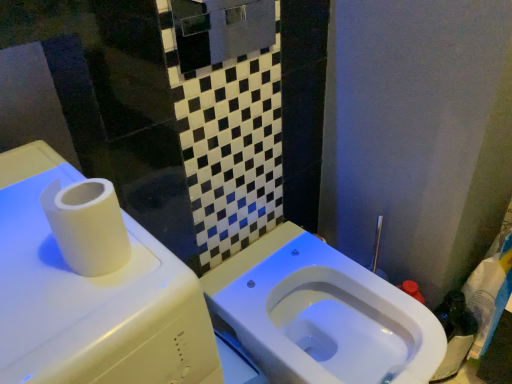
Question: Can you confirm if white matte water tank at upper left is positioned to the left of white glossy toilet at center?

Choices:
 (A) yes
 (B) no

Answer: (A)

Question: Is white matte water tank at upper left oriented away from white glossy toilet at center?

Choices:
 (A) yes
 (B) no

Answer: (B)

Question: From a real-world perspective, is white matte water tank at upper left positioned under white glossy toilet at center based on gravity?

Choices:
 (A) yes
 (B) no

Answer: (B)

Question: From a real-world perspective, is white matte water tank at upper left physically above white glossy toilet at center?

Choices:
 (A) yes
 (B) no

Answer: (A)

Question: Is white matte water tank at upper left completely or partially outside of white glossy toilet at center?

Choices:
 (A) yes
 (B) no

Answer: (A)

Question: Are white matte water tank at upper left and white glossy toilet at center far apart?

Choices:
 (A) no
 (B) yes

Answer: (A)

Question: From the image's perspective, is white glossy toilet at center over white matte water tank at upper left?

Choices:
 (A) yes
 (B) no

Answer: (B)

Question: Is white glossy toilet at center turned away from white matte water tank at upper left?

Choices:
 (A) yes
 (B) no

Answer: (B)

Question: Does white glossy toilet at center come in front of white matte water tank at upper left?

Choices:
 (A) yes
 (B) no

Answer: (B)

Question: Can you confirm if white glossy toilet at center is positioned to the right of white matte water tank at upper left?

Choices:
 (A) no
 (B) yes

Answer: (B)

Question: From a real-world perspective, is white glossy toilet at center located higher than white matte water tank at upper left?

Choices:
 (A) no
 (B) yes

Answer: (A)

Question: Is white glossy toilet at center thinner than white matte water tank at upper left?

Choices:
 (A) yes
 (B) no

Answer: (A)

Question: Looking at their shapes, would you say white matte water tank at upper left is wider or thinner than white glossy toilet at center?

Choices:
 (A) thin
 (B) wide

Answer: (B)